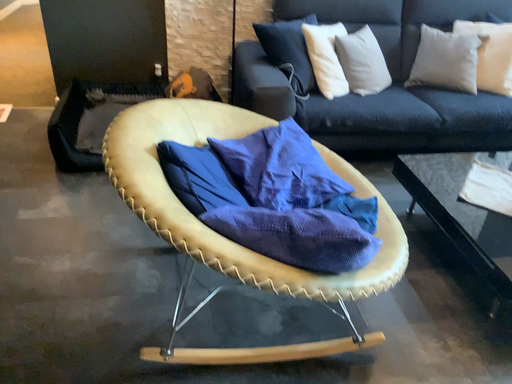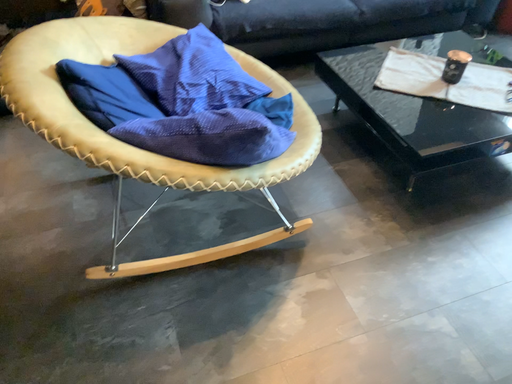
Question: Which way did the camera rotate in the video?

Choices:
 (A) rotated downward
 (B) rotated upward

Answer: (A)